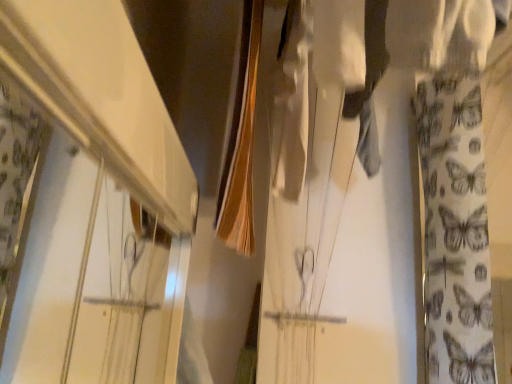
In order to face white fabric with butterfly pattern at right, should I rotate leftwards or rightwards?

You should rotate right by 29.147 degrees.

In order to click on white fabric with butterfly pattern at right in this screenshot , I will do `click(455, 230)`.

Describe the element at coordinates (241, 143) in the screenshot. I see `smooth brown fabric at center` at that location.

In order to click on white fabric with butterfly pattern at right in this screenshot , I will do click(x=455, y=230).

Is white fabric with butterfly pattern at right oriented away from white glossy shelf at upper left?

No, white fabric with butterfly pattern at right is not facing away from white glossy shelf at upper left.

Is white fabric with butterfly pattern at right wider than white glossy shelf at upper left?

Correct, the width of white fabric with butterfly pattern at right exceeds that of white glossy shelf at upper left.

What's the angular difference between white fabric with butterfly pattern at right and white glossy shelf at upper left's facing directions?

There is a 90.1-degree angle between the facing directions of white fabric with butterfly pattern at right and white glossy shelf at upper left.

Considering the relative sizes of white fabric with butterfly pattern at right and white glossy shelf at upper left in the image provided, is white fabric with butterfly pattern at right taller than white glossy shelf at upper left?

Yes.

Which object is wider, white fabric with butterfly pattern at right or smooth brown fabric at center?

With larger width is white fabric with butterfly pattern at right.

Is smooth brown fabric at center inside white fabric with butterfly pattern at right?

No.

Could you tell me if white fabric with butterfly pattern at right is turned towards smooth brown fabric at center?

No, white fabric with butterfly pattern at right does not turn towards smooth brown fabric at center.

Based on the photo, can you confirm if white fabric with butterfly pattern at right is taller than smooth brown fabric at center?

Yes.

Does white glossy shelf at upper left appear on the left side of smooth brown fabric at center?

Yes, white glossy shelf at upper left is to the left of smooth brown fabric at center.

Identify the location of shelf beneath the smooth brown fabric at center (from a real-world perspective). (102, 96).

Considering the relative sizes of white glossy shelf at upper left and smooth brown fabric at center in the image provided, is white glossy shelf at upper left thinner than smooth brown fabric at center?

In fact, white glossy shelf at upper left might be wider than smooth brown fabric at center.

Can you tell me how much white glossy shelf at upper left and smooth brown fabric at center differ in facing direction?

0.344 degrees separate the facing orientations of white glossy shelf at upper left and smooth brown fabric at center.

Identify the location of curtain on the right of the smooth brown fabric at center. (455, 230).

How many degrees apart are the facing directions of smooth brown fabric at center and white fabric with butterfly pattern at right?

The facing directions of smooth brown fabric at center and white fabric with butterfly pattern at right are 90.5 degrees apart.

Is smooth brown fabric at center looking in the opposite direction of white fabric with butterfly pattern at right?

No, smooth brown fabric at center is not facing the opposite direction of white fabric with butterfly pattern at right.

How distant is smooth brown fabric at center from white fabric with butterfly pattern at right?

26.75 inches.

Considering the sizes of smooth brown fabric at center and white glossy shelf at upper left in the image, is smooth brown fabric at center bigger or smaller than white glossy shelf at upper left?

Clearly, smooth brown fabric at center is larger in size than white glossy shelf at upper left.

Does smooth brown fabric at center have a greater height compared to white glossy shelf at upper left?

Correct, smooth brown fabric at center is much taller as white glossy shelf at upper left.

In the image, is smooth brown fabric at center on the left side or the right side of white glossy shelf at upper left?

From the image, it's evident that smooth brown fabric at center is to the right of white glossy shelf at upper left.

From a real-world perspective, is smooth brown fabric at center positioned above or below white glossy shelf at upper left?

Clearly, from a real-world perspective, smooth brown fabric at center is above white glossy shelf at upper left.

In the scene shown: How different are the orientations of white glossy shelf at upper left and white fabric with butterfly pattern at right in degrees?

The angle between the facing direction of white glossy shelf at upper left and the facing direction of white fabric with butterfly pattern at right is 90.1 degrees.

Can you confirm if white glossy shelf at upper left is wider than white fabric with butterfly pattern at right?

In fact, white glossy shelf at upper left might be narrower than white fabric with butterfly pattern at right.

Who is smaller, white glossy shelf at upper left or white fabric with butterfly pattern at right?

With smaller size is white glossy shelf at upper left.

Find the location of a particular element. shelf above the white fabric with butterfly pattern at right (from the image's perspective) is located at coordinates (102, 96).

Where is `clothesline on the left of the white fabric with butterfly pattern at right`? clothesline on the left of the white fabric with butterfly pattern at right is located at coordinates (241, 143).

Estimate the real-world distances between objects in this image. Which object is closer to white glossy shelf at upper left, white fabric with butterfly pattern at right or smooth brown fabric at center?

smooth brown fabric at center is positioned closer to the anchor white glossy shelf at upper left.

When comparing their distances from smooth brown fabric at center, does white glossy shelf at upper left or white fabric with butterfly pattern at right seem closer?

The object closer to smooth brown fabric at center is white glossy shelf at upper left.

From the image, which object appears to be nearer to white fabric with butterfly pattern at right, white glossy shelf at upper left or smooth brown fabric at center?

Among the two, smooth brown fabric at center is located nearer to white fabric with butterfly pattern at right.

Which object lies further to the anchor point smooth brown fabric at center, white fabric with butterfly pattern at right or white glossy shelf at upper left?

Based on the image, white fabric with butterfly pattern at right appears to be further to smooth brown fabric at center.

Estimate the real-world distances between objects in this image. Which object is further from white glossy shelf at upper left, smooth brown fabric at center or white fabric with butterfly pattern at right?

white fabric with butterfly pattern at right lies further to white glossy shelf at upper left than the other object.

Estimate the real-world distances between objects in this image. Which object is further from white fabric with butterfly pattern at right, smooth brown fabric at center or white glossy shelf at upper left?

white glossy shelf at upper left is further to white fabric with butterfly pattern at right.

Locate an element on the screen. This screenshot has height=384, width=512. clothesline between white glossy shelf at upper left and white fabric with butterfly pattern at right in the horizontal direction is located at coordinates (241, 143).